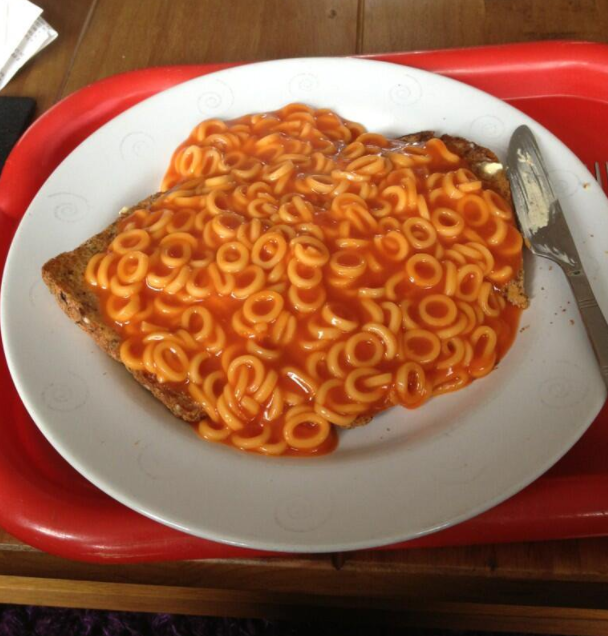
Where is `brown towel`? brown towel is located at coordinates (98, 619).